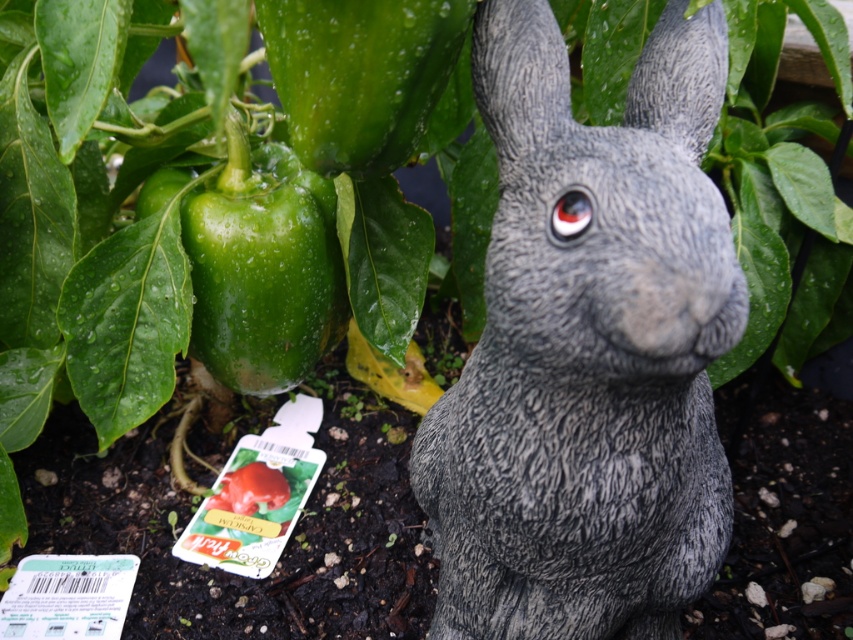
Question: Can you confirm if green matte bell pepper at left is thinner than green matte bell pepper at upper left?

Choices:
 (A) no
 (B) yes

Answer: (A)

Question: Is green matte bell pepper at left to the right of green matte bell pepper at upper left from the viewer's perspective?

Choices:
 (A) no
 (B) yes

Answer: (A)

Question: Based on their relative distances, which object is nearer to the green matte bell pepper at left?

Choices:
 (A) green matte bell pepper at upper left
 (B) gray stone rabbit at center

Answer: (A)

Question: Is green matte bell pepper at left positioned behind green matte bell pepper at upper left?

Choices:
 (A) no
 (B) yes

Answer: (B)

Question: Which point is closer to the camera?

Choices:
 (A) gray stone rabbit at center
 (B) green matte bell pepper at left
 (C) green matte bell pepper at upper left

Answer: (A)

Question: Which point is closer to the camera?

Choices:
 (A) (393, 1)
 (B) (257, 248)
 (C) (622, 352)

Answer: (C)